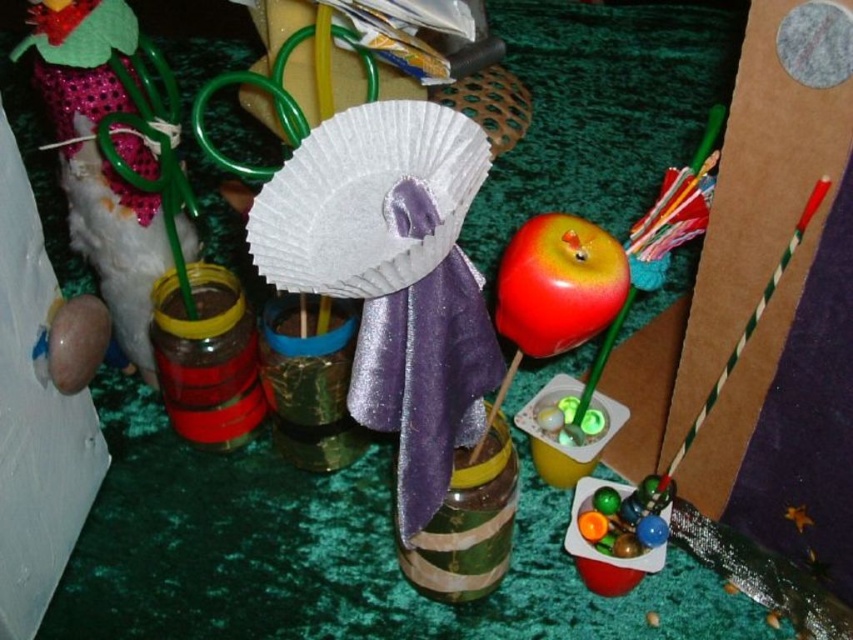
You are organizing a craft fair and need to place the matte brown jar at left and the shiny red apple at center on a shelf. If the shelf has limited space, which item should you place first to ensure both fit?

Since the matte brown jar at left is wider than the shiny red apple at center, you should place the shiny red apple at center first to accommodate the wider jar afterward.